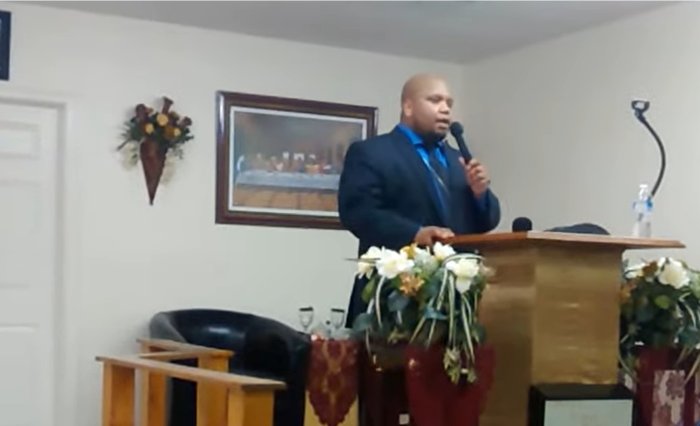
Locate an element on the screen. picture frame is located at coordinates (281, 105).